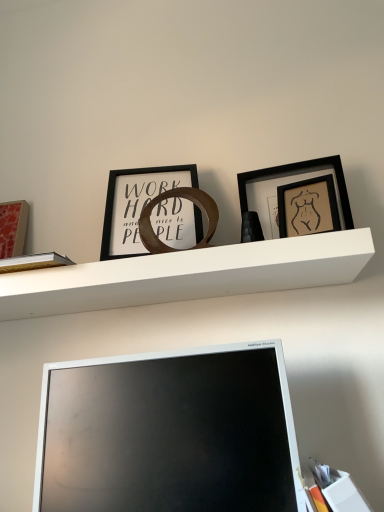
Question: Visually, is matte black picture frame at upper right, which ranks as the 3th picture frame in left-to-right order, positioned to the left or to the right of matte silver monitor at lower center?

Choices:
 (A) left
 (B) right

Answer: (B)

Question: From the image's perspective, is matte black picture frame at upper right, the first picture frame from the right, above or below matte silver monitor at lower center?

Choices:
 (A) above
 (B) below

Answer: (A)

Question: Considering the real-world distances, which object is closest to the black matte picture frame at center, which is counted as the second picture frame, starting from the left?

Choices:
 (A) matte red picture frame at left, placed as the first picture frame when sorted from left to right
 (B) matte black picture frame at upper right, which ranks as the 3th picture frame in left-to-right order
 (C) white paper at lower right
 (D) white matte shelf at center
 (E) matte silver monitor at lower center

Answer: (D)

Question: Considering the real-world distances, which object is farthest from the matte silver monitor at lower center?

Choices:
 (A) white matte shelf at center
 (B) white paper at lower right
 (C) matte red picture frame at left, placed as the first picture frame when sorted from left to right
 (D) black matte picture frame at center, which is counted as the second picture frame, starting from the left
 (E) matte black picture frame at upper right, the first picture frame from the right

Answer: (C)